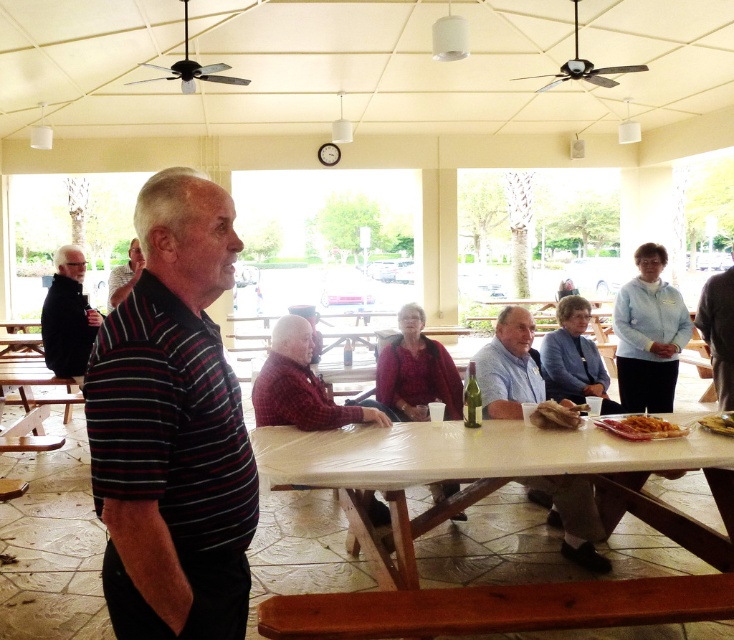
Question: Observing the image, what is the correct spatial positioning of striped cotton shirt at left in reference to black matte jacket at left?

Choices:
 (A) above
 (B) below

Answer: (B)

Question: Among these objects, which one is farthest from the camera?

Choices:
 (A) striped cotton shirt at left
 (B) golden crispy bread at lower right

Answer: (B)

Question: Among these objects, which one is farthest from the camera?

Choices:
 (A) brown crumbly bread at center
 (B) golden crispy bread at lower right
 (C) striped cotton shirt at left
 (D) white plastic table at center

Answer: (A)

Question: Based on their relative distances, which object is nearer to the black matte jacket at left?

Choices:
 (A) light blue cotton shirt at center
 (B) striped cotton shirt at left

Answer: (A)

Question: Does red plaid shirt at center appear over yellowish matte plate at lower center?

Choices:
 (A) no
 (B) yes

Answer: (B)

Question: Is striped cotton shirt at left behind brown crumbly bread at center?

Choices:
 (A) yes
 (B) no

Answer: (B)